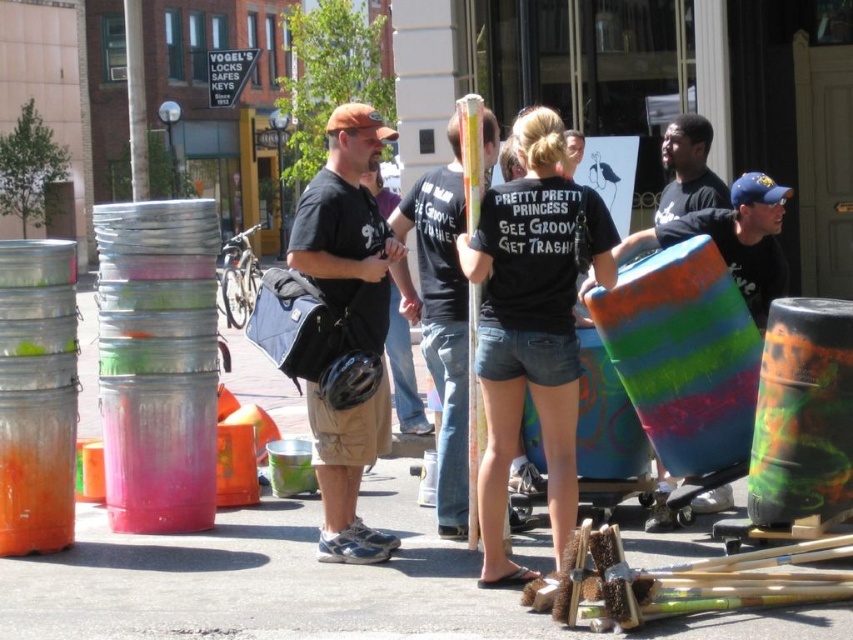
Does black t-shirt at center have a smaller size compared to matte black t-shirt at center?

Actually, black t-shirt at center might be larger than matte black t-shirt at center.

The width and height of the screenshot is (853, 640). Find the location of `black t-shirt at center`. black t-shirt at center is located at coordinates (440, 320).

Locate an element on the screen. The image size is (853, 640). black t-shirt at center is located at coordinates (440, 320).

This screenshot has width=853, height=640. What do you see at coordinates (265, 579) in the screenshot?
I see `smooth concrete pavement at center` at bounding box center [265, 579].

From the picture: How distant is smooth concrete pavement at center from black cotton shirt at center?

smooth concrete pavement at center and black cotton shirt at center are 3.37 meters apart from each other.

Is point (413, 600) positioned after point (688, 138)?

That is False.

Locate an element on the screen. Image resolution: width=853 pixels, height=640 pixels. smooth concrete pavement at center is located at coordinates (265, 579).

Does smooth concrete pavement at center have a greater height compared to multicolored painted drum at center?

In fact, smooth concrete pavement at center may be shorter than multicolored painted drum at center.

From the picture: Can you confirm if smooth concrete pavement at center is positioned below multicolored painted drum at center?

Yes, smooth concrete pavement at center is below multicolored painted drum at center.

Which is behind, point (273, 417) or point (744, 241)?

The point (273, 417) is more distant.

Locate an element on the screen. Image resolution: width=853 pixels, height=640 pixels. smooth concrete pavement at center is located at coordinates (265, 579).